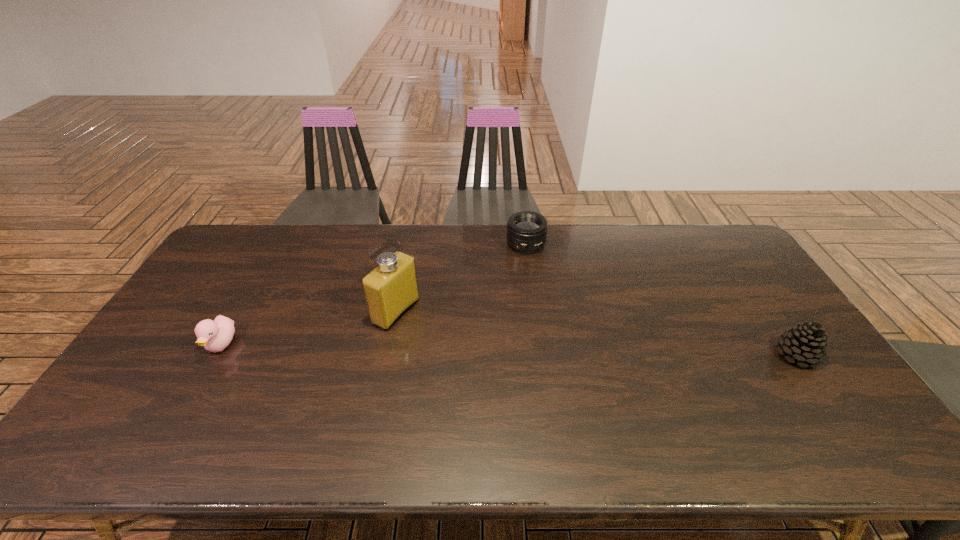
The image size is (960, 540). I want to click on vacant area situated 0.320m on the side of the farthest object with brand markings and control switches, so click(527, 322).

Identify the location of free region located 0.220m on the side of the farthest object with brand markings and control switches. (527, 299).

Where is `vacant space located on the side of the farthest object with brand markings and control switches`? The image size is (960, 540). vacant space located on the side of the farthest object with brand markings and control switches is located at coordinates (526, 273).

At what (x,y) coordinates should I click in order to perform the action: click on object that is at the far edge. Please return your answer as a coordinate pair (x, y). This screenshot has height=540, width=960. Looking at the image, I should click on (x=526, y=231).

Locate an element on the screen. Image resolution: width=960 pixels, height=540 pixels. object located at the left edge is located at coordinates (215, 336).

This screenshot has width=960, height=540. In order to click on object positioned at the right edge in this screenshot , I will do `click(806, 343)`.

Locate an element on the screen. Image resolution: width=960 pixels, height=540 pixels. vacant position at the far edge of the desktop is located at coordinates 570,257.

In the image, there is a desktop. Where is `blank space at the near edge`? blank space at the near edge is located at coordinates tap(651, 394).

In the image, there is a desktop. In order to click on vacant space at the left edge in this screenshot , I will do tap(182, 323).

In the image, there is a desktop. Where is `vacant space at the far left corner`? The image size is (960, 540). vacant space at the far left corner is located at coordinates (x=227, y=247).